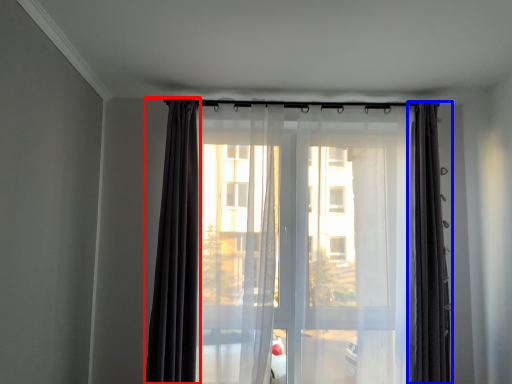
Question: Which point is closer to the camera, curtain (highlighted by a red box) or curtain (highlighted by a blue box)?

Choices:
 (A) curtain
 (B) curtain

Answer: (A)